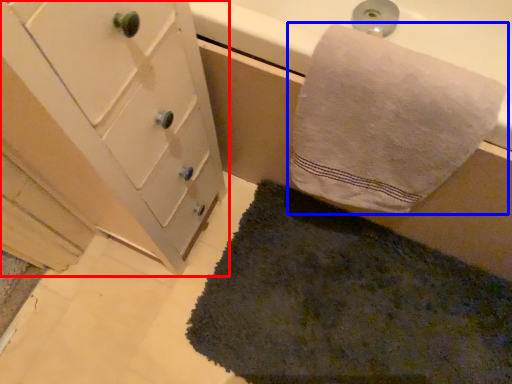
Question: Which point is closer to the camera, bathroom cabinet (highlighted by a red box) or towel (highlighted by a blue box)?

Choices:
 (A) bathroom cabinet
 (B) towel

Answer: (A)